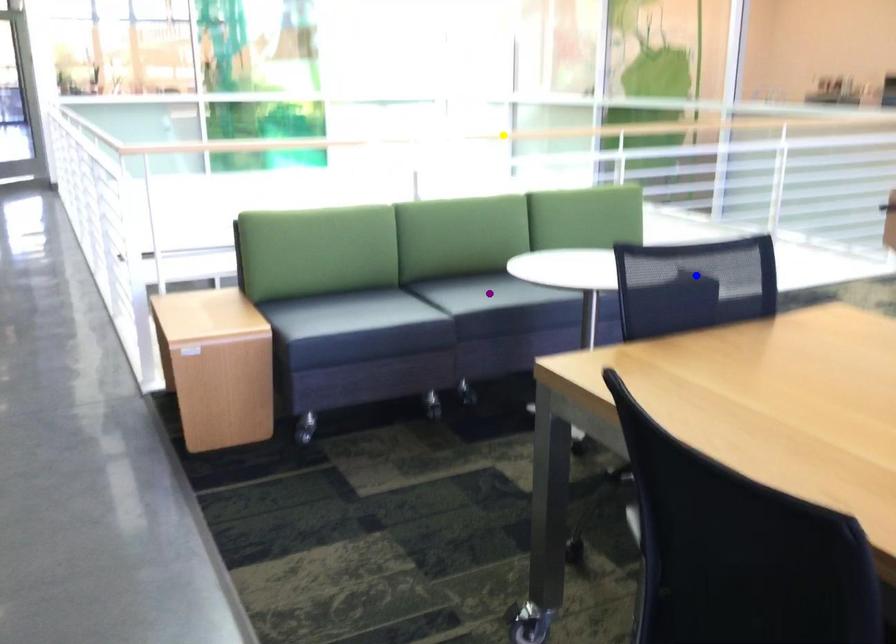
Order these from farthest to nearest:
blue point, yellow point, purple point

yellow point < purple point < blue point